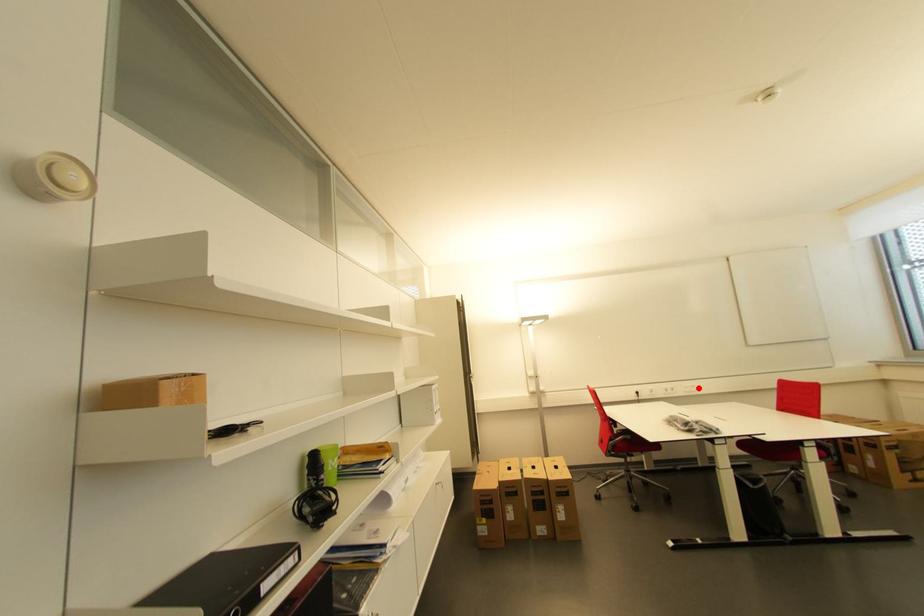
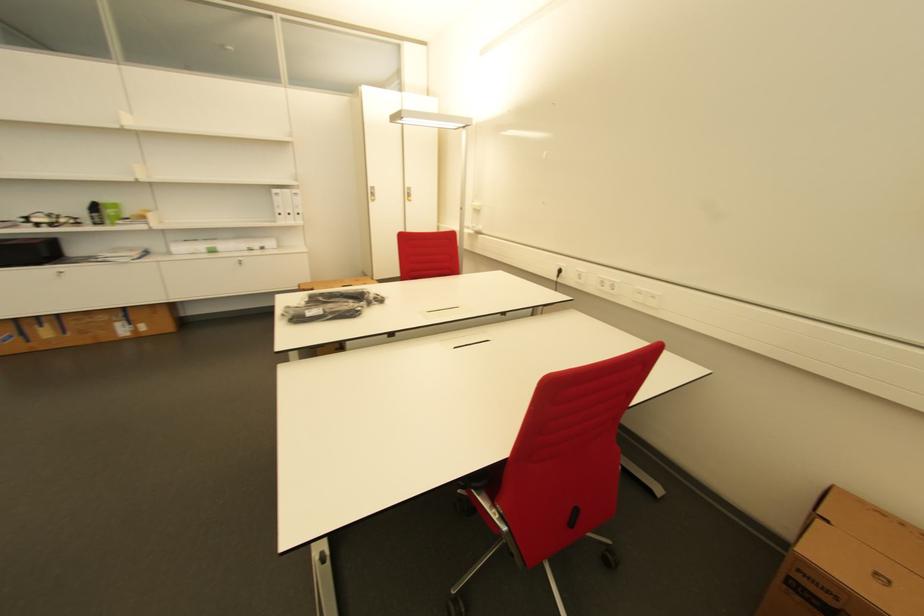
The point at the highlighted location is marked in the first image. Where is the corresponding point in the second image?

(659, 299)